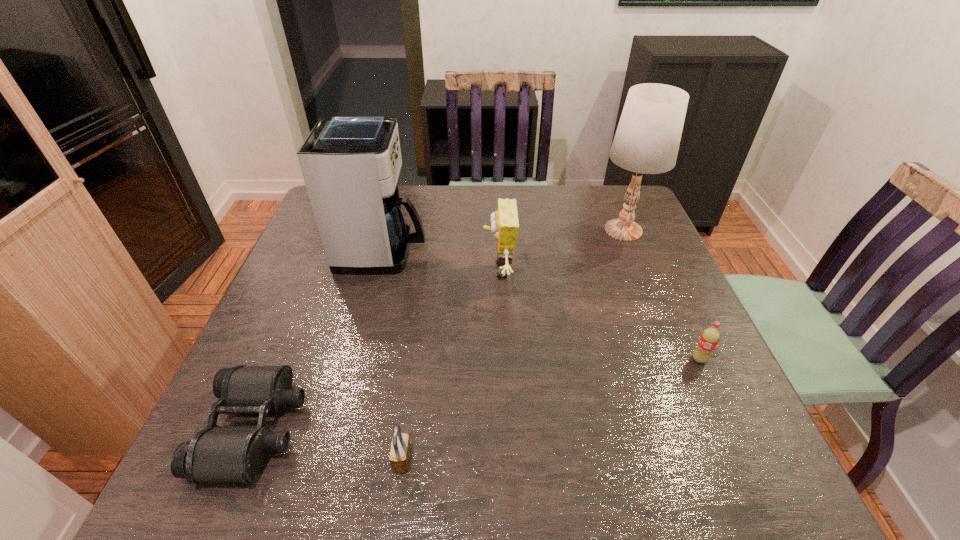
Where is `lamp`? lamp is located at coordinates pos(647,139).

You are a GUI agent. You are given a task and a screenshot of the screen. Output one action in this format:
    pyautogui.click(x=<x>, y=<y>)
    Task: Click on the coffee maker
    This screenshot has width=960, height=540.
    Given the screenshot: What is the action you would take?
    pyautogui.click(x=350, y=164)

Identify the location of sponge. (504, 225).

In order to click on the third object from right to left in this screenshot , I will do coord(504,225).

Find the location of `the third nearest object`. the third nearest object is located at coordinates (709, 338).

This screenshot has width=960, height=540. Identify the location of padlock. 400,452.

This screenshot has height=540, width=960. In order to click on the shortest object in this screenshot , I will do `click(217, 453)`.

This screenshot has height=540, width=960. What are the coordinates of `vacant space situated 0.170m on the front of the lamp` in the screenshot? It's located at (648, 289).

Find the location of a particular element. The width and height of the screenshot is (960, 540). vacant space located 0.110m on the front panel of the coffee maker is located at coordinates (466, 252).

This screenshot has height=540, width=960. In order to click on free spot located on the face of the third tallest object in this screenshot , I will do `click(366, 272)`.